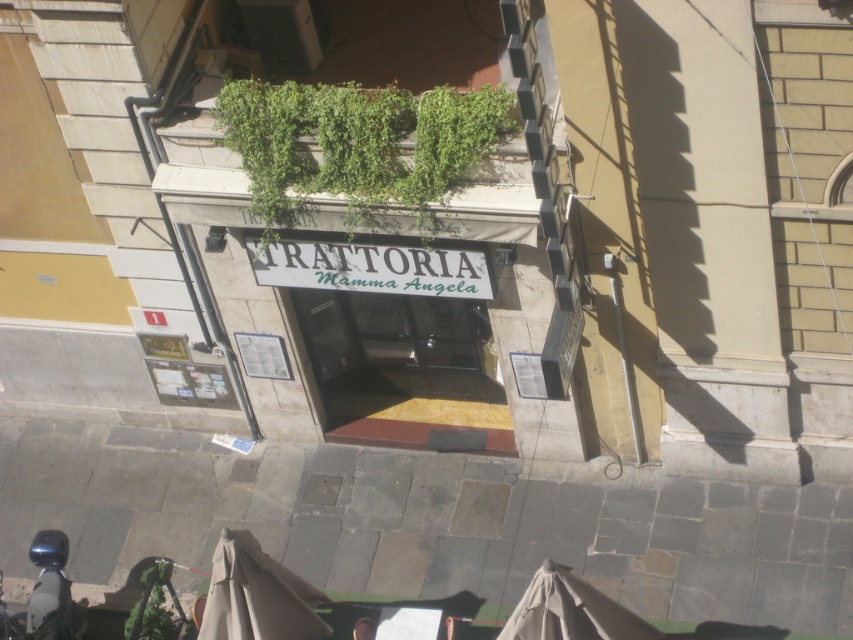
Who is positioned more to the right, black glass door at center or shiny blue motorcycle at lower left?

black glass door at center

Is point (345, 381) positioned after point (50, 580)?

Yes, point (345, 381) is farther from viewer.

Identify the location of black glass door at center. (404, 369).

Is white stone signboard at center to the left of green leafy plant at lower left from the viewer's perspective?

Incorrect, white stone signboard at center is not on the left side of green leafy plant at lower left.

Describe the element at coordinates (387, 236) in the screenshot. I see `white stone signboard at center` at that location.

The height and width of the screenshot is (640, 853). In order to click on white stone signboard at center in this screenshot , I will do `click(387, 236)`.

Between point (368, 289) and point (55, 561), which one is positioned in front?

Positioned in front is point (368, 289).

Does white stone signboard at center appear under shiny blue motorcycle at lower left?

No, white stone signboard at center is not below shiny blue motorcycle at lower left.

I want to click on white stone signboard at center, so click(387, 236).

At what (x,y) coordinates should I click in order to perform the action: click on white stone signboard at center. Please return your answer as a coordinate pair (x, y). The width and height of the screenshot is (853, 640). Looking at the image, I should click on (387, 236).